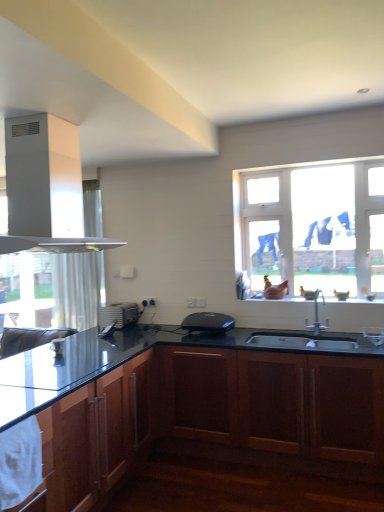
Question: Considering the positions of white matte gas stove at upper left and matte glass window sill at center in the image, is white matte gas stove at upper left wider or thinner than matte glass window sill at center?

Choices:
 (A) thin
 (B) wide

Answer: (B)

Question: Considering the positions of white matte gas stove at upper left and matte glass window sill at center in the image, is white matte gas stove at upper left taller or shorter than matte glass window sill at center?

Choices:
 (A) tall
 (B) short

Answer: (A)

Question: Which is farther from the white matte gas stove at upper left?

Choices:
 (A) silver metallic faucet at center
 (B) matte glass window sill at center
 (C) clear glass window at upper right
 (D) dark wood cabinet at lower center, acting as the 2th cabinetry starting from the left
 (E) satin silver toaster at lower center, which is the second appliance from right to left

Answer: (A)

Question: Estimate the real-world distances between objects in this image. Which object is farther from the dark wood cabinet at lower center, acting as the 2th cabinetry starting from the left?

Choices:
 (A) clear glass window at upper right
 (B) silver metallic faucet at center
 (C) matte glass window sill at center
 (D) white matte gas stove at upper left
 (E) black plastic toaster at center, the first appliance in the front-to-back sequence

Answer: (B)